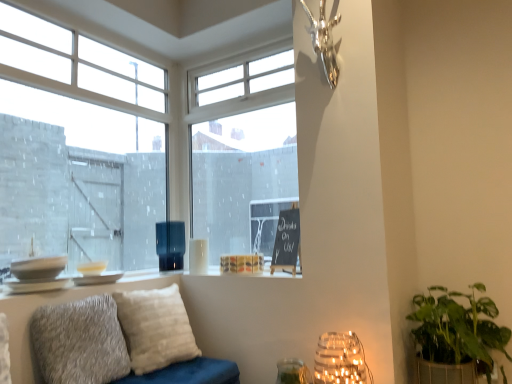
Question: From the image's perspective, relative to matte black vase at center, which is the second lamp in right-to-left order, is white textured pillow at center, the 2th pillow from the front, above or below?

Choices:
 (A) below
 (B) above

Answer: (A)

Question: Choose the correct answer: Is white textured pillow at center, the 2th pillow from the front, inside matte black vase at center, the second lamp viewed from the front, or outside it?

Choices:
 (A) inside
 (B) outside

Answer: (B)

Question: Estimate the real-world distances between objects in this image. Which object is farther from the illuminated glass jar at lower right, the second lamp when ordered from left to right?

Choices:
 (A) white textured pillow at center, the first pillow in the back-to-front sequence
 (B) matte black vase at center, positioned as the 1th lamp in top-to-bottom order
 (C) fuzzy gray pillow at lower left, acting as the 2th pillow starting from the back
 (D) green leafy plant in woven basket at lower right
 (E) clear glass window at upper left, which is counted as the 1th window, starting from the left

Answer: (E)

Question: Based on their relative distances, which object is nearer to the transparent glass window at center, which is the second window in left-to-right order?

Choices:
 (A) fuzzy gray pillow at lower left, which is the first pillow in front-to-back order
 (B) clear glass vase at lower center
 (C) white textured pillow at center, the 2th pillow from the front
 (D) illuminated glass jar at lower right, which is counted as the second lamp, starting from the top
 (E) green leafy plant in woven basket at lower right

Answer: (C)